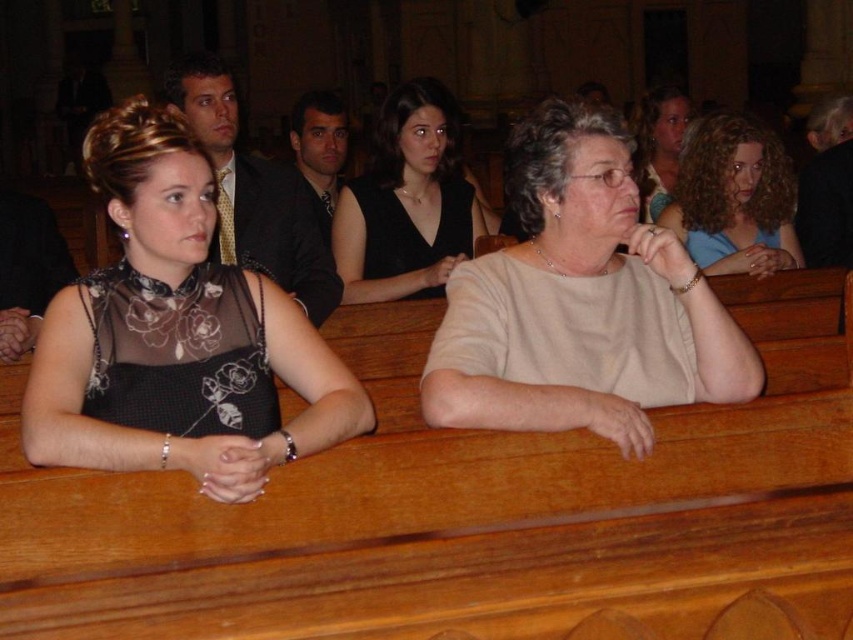
Question: Which object appears farthest from the camera in this image?

Choices:
 (A) matte gold tie at upper left
 (B) matte black dress at upper center
 (C) dark brown hair at center

Answer: (B)

Question: Does curly hair at upper right have a smaller size compared to matte black dress at upper center?

Choices:
 (A) no
 (B) yes

Answer: (B)

Question: Among these points, which one is farthest from the camera?

Choices:
 (A) (712, 358)
 (B) (656, 138)
 (C) (177, 467)
 (D) (433, 280)

Answer: (B)

Question: Which of the following is the closest to the observer?

Choices:
 (A) matte black dress at upper center
 (B) beige cotton shirt at center
 (C) curly hair at upper right

Answer: (B)

Question: Can you confirm if dark brown hair at center is thinner than matte black dress at upper center?

Choices:
 (A) no
 (B) yes

Answer: (B)

Question: Does matte gold tie at upper left appear on the left side of matte black dress at upper center?

Choices:
 (A) no
 (B) yes

Answer: (B)